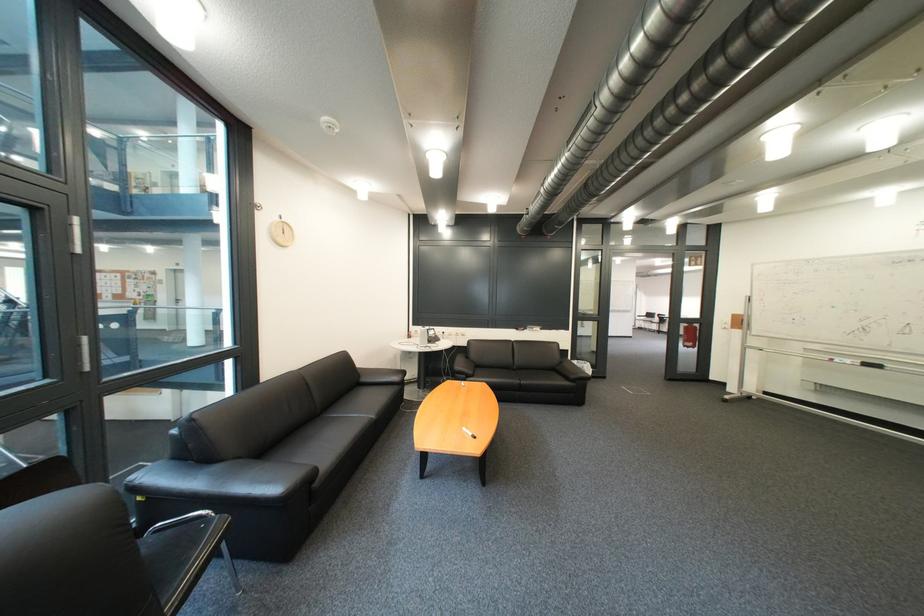
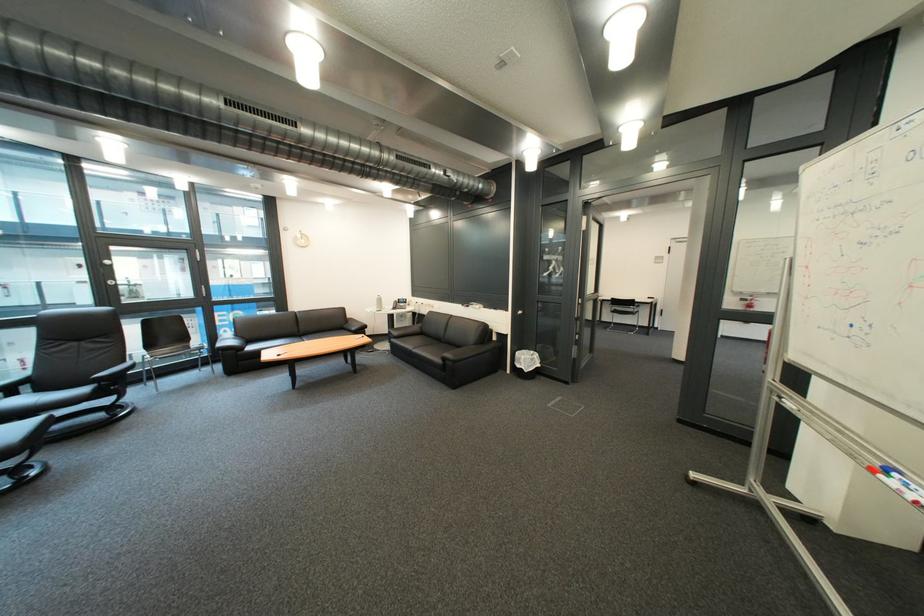
Where in the second image is the point corresponding to point (845, 361) from the first image?

(901, 472)